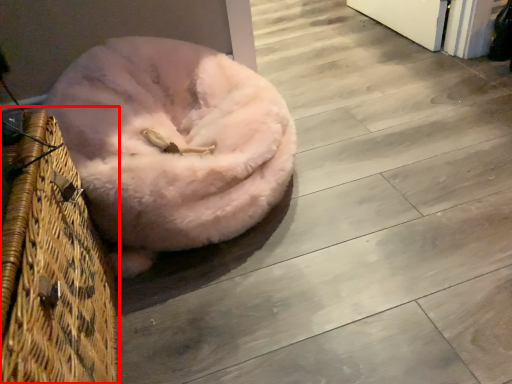
Question: Where is basket (annotated by the red box) located in relation to dog bed in the image?

Choices:
 (A) left
 (B) right

Answer: (A)